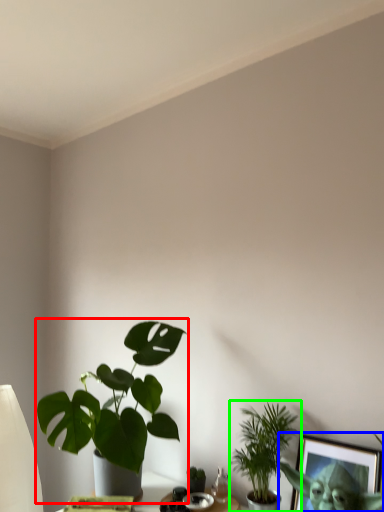
Question: Considering the real-world distances, which object is closest to houseplant (highlighted by a red box)? picture frame (highlighted by a blue box) or houseplant (highlighted by a green box).

Choices:
 (A) picture frame
 (B) houseplant

Answer: (B)